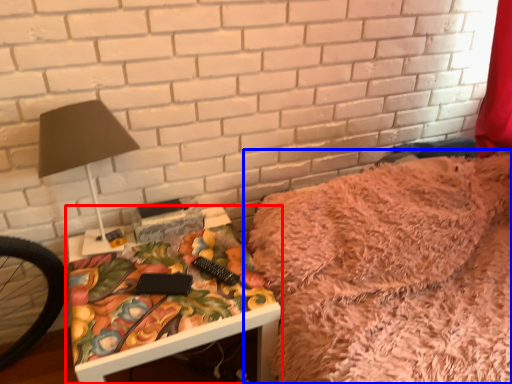
Question: Which point is closer to the camera, table (highlighted by a red box) or furniture (highlighted by a blue box)?

Choices:
 (A) table
 (B) furniture

Answer: (B)